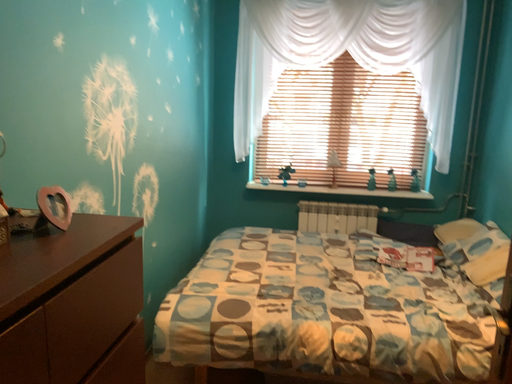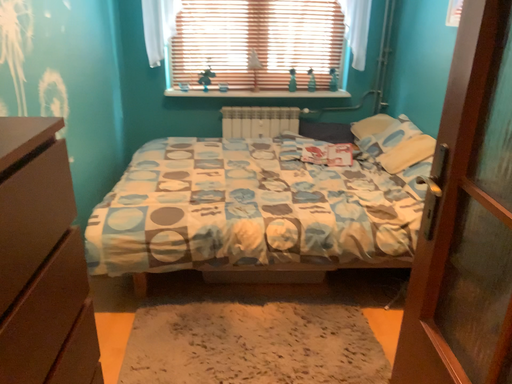
Question: Which way did the camera rotate in the video?

Choices:
 (A) rotated left
 (B) rotated right

Answer: (B)